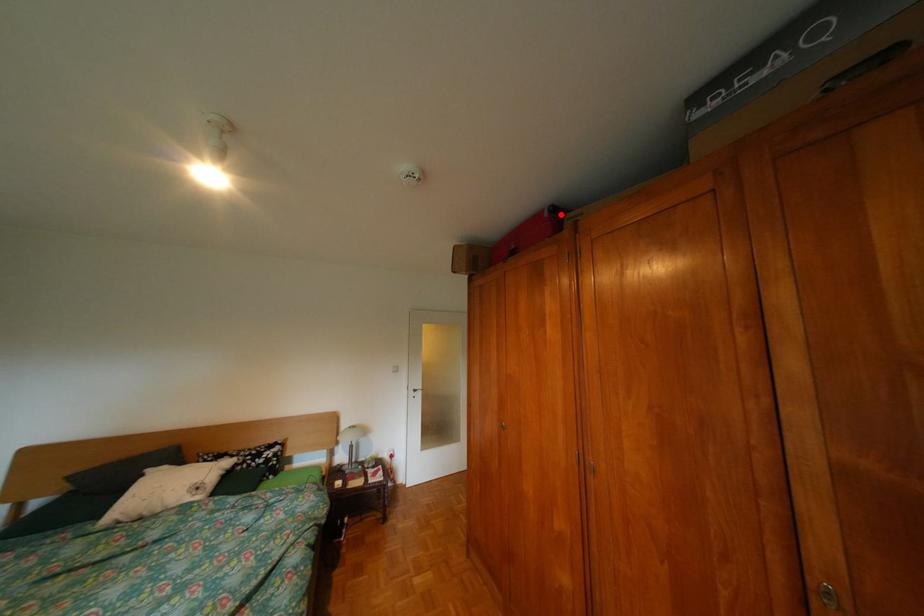
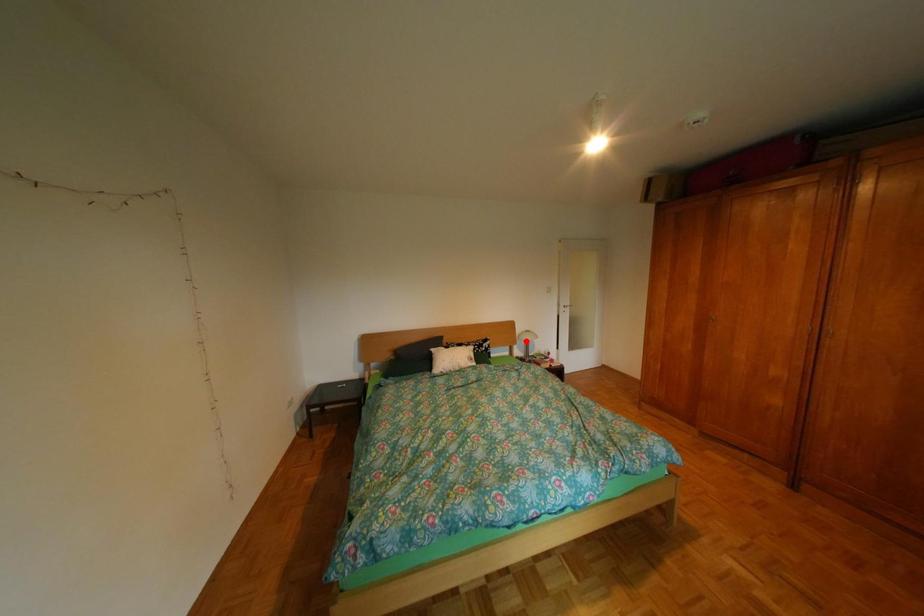
I am providing you with two images of the same scene from different viewpoints. A red point is marked on the first image and another point is marked on the second image. Does the point marked in image1 correspond to the same location as the one in image2?

No